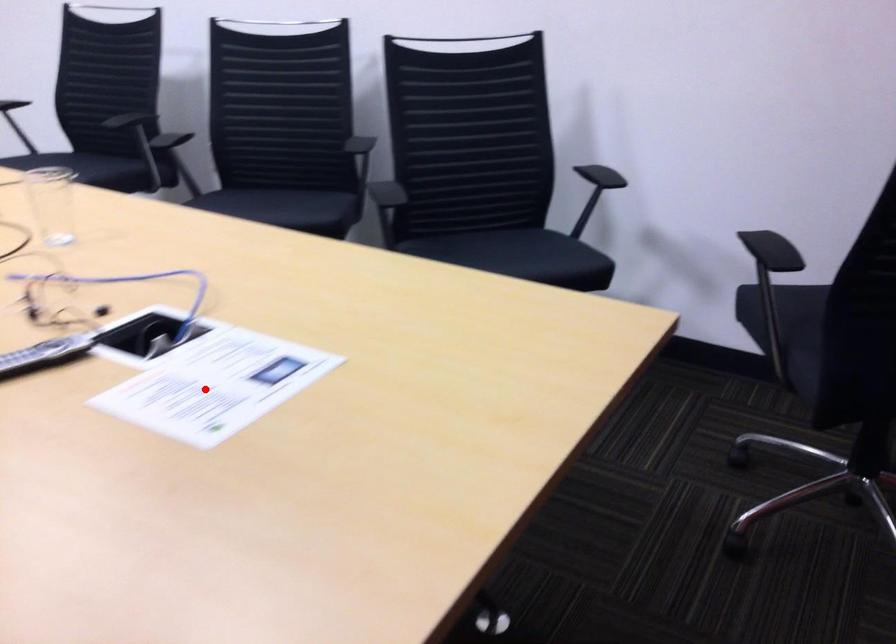
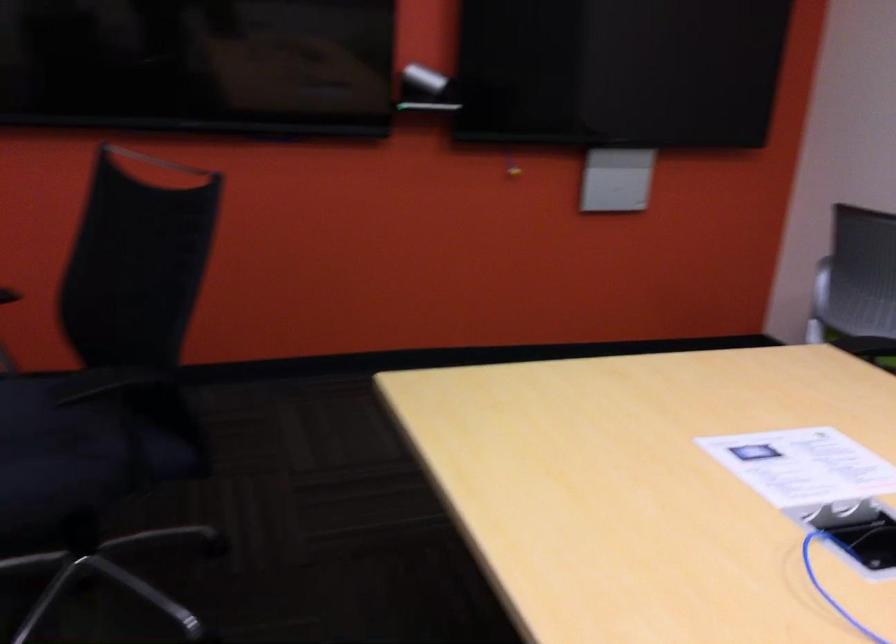
Question: I am providing you with two images of the same scene from different viewpoints. Image1 has a red point marked. In image2, the corresponding 3D location appears at what relative position? Reply with the corresponding letter.

Choices:
 (A) Closer
 (B) Farther

Answer: (B)